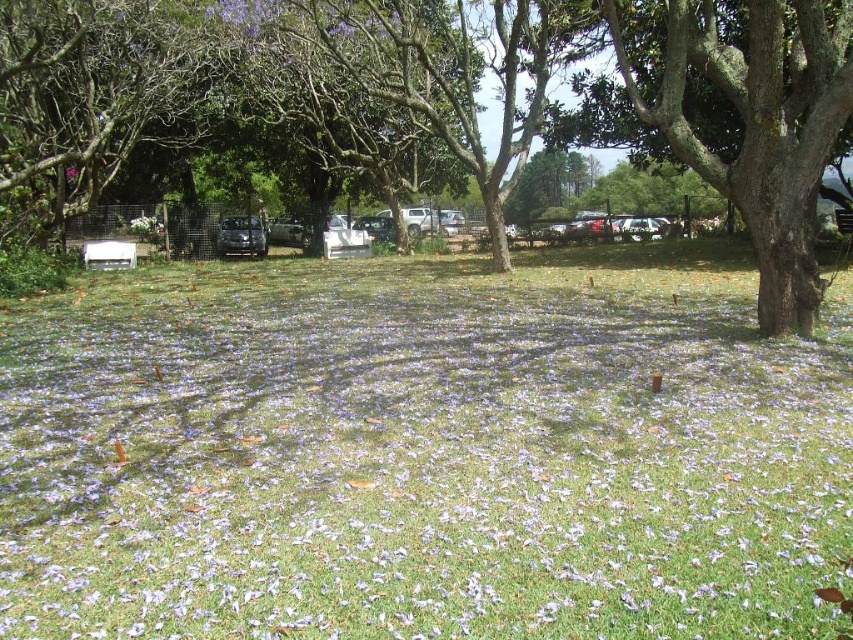
Can you confirm if green leafy tree at center is smaller than white matte bench at lower left?

No, green leafy tree at center is not smaller than white matte bench at lower left.

Is green leafy tree at center above white matte bench at lower left?

Correct, green leafy tree at center is located above white matte bench at lower left.

What do you see at coordinates (463, 90) in the screenshot? I see `green leafy tree at center` at bounding box center [463, 90].

I want to click on green leafy tree at center, so click(x=463, y=90).

Between green leafy tree at center and satin black car at center, which one has less height?

Standing shorter between the two is satin black car at center.

Find the location of `green leafy tree at center`. green leafy tree at center is located at coordinates (463, 90).

Who is more distant from viewer, (666,97) or (218,243)?

Positioned behind is point (218,243).

Locate an element on the screen. The width and height of the screenshot is (853, 640). green leafy tree at center is located at coordinates (463, 90).

Who is positioned more to the right, purple grass at center or white matte bench at lower left?

purple grass at center is more to the right.

Who is shorter, purple grass at center or white matte bench at lower left?

Standing shorter between the two is white matte bench at lower left.

Is point (785, 509) closer to viewer compared to point (83, 248)?

Yes, it is.

The image size is (853, 640). I want to click on purple grass at center, so click(x=422, y=452).